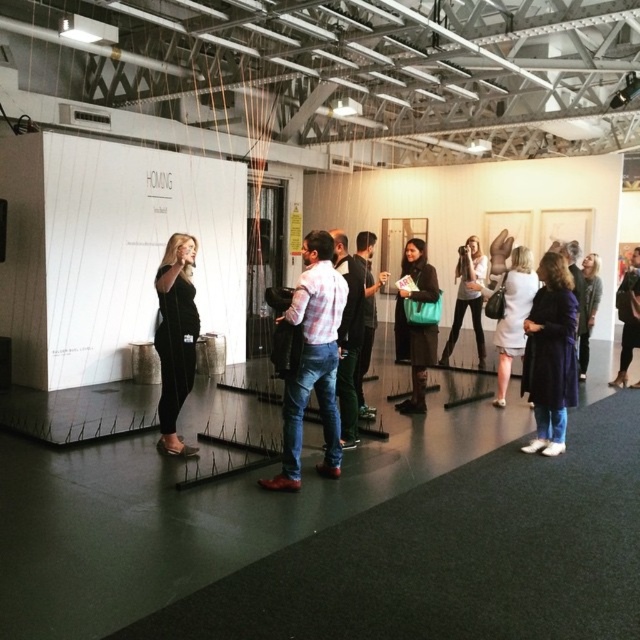
Question: Can you confirm if black velvet dress at center is thinner than dark gray sweater at right?

Choices:
 (A) yes
 (B) no

Answer: (A)

Question: Can you confirm if black velvet dress at center is smaller than dark gray sweater at right?

Choices:
 (A) no
 (B) yes

Answer: (B)

Question: Estimate the real-world distances between objects in this image. Which object is closer to the dark gray suit at center?

Choices:
 (A) black velvet dress at center
 (B) black leather jacket at center
 (C) matte black jacket at center
 (D) white matte jacket at center

Answer: (C)

Question: Which point appears farthest from the camera in this image?

Choices:
 (A) (580, 268)
 (B) (616, 305)
 (C) (369, 406)
 (D) (352, 326)

Answer: (A)

Question: Observing the image, what is the correct spatial positioning of dark blue coat at lower right in reference to dark gray suit at center?

Choices:
 (A) below
 (B) above

Answer: (B)

Question: Which of these objects is positioned farthest from the white cotton shirt at center?

Choices:
 (A) plaid shirt at center
 (B) dark gray sweater at right

Answer: (B)